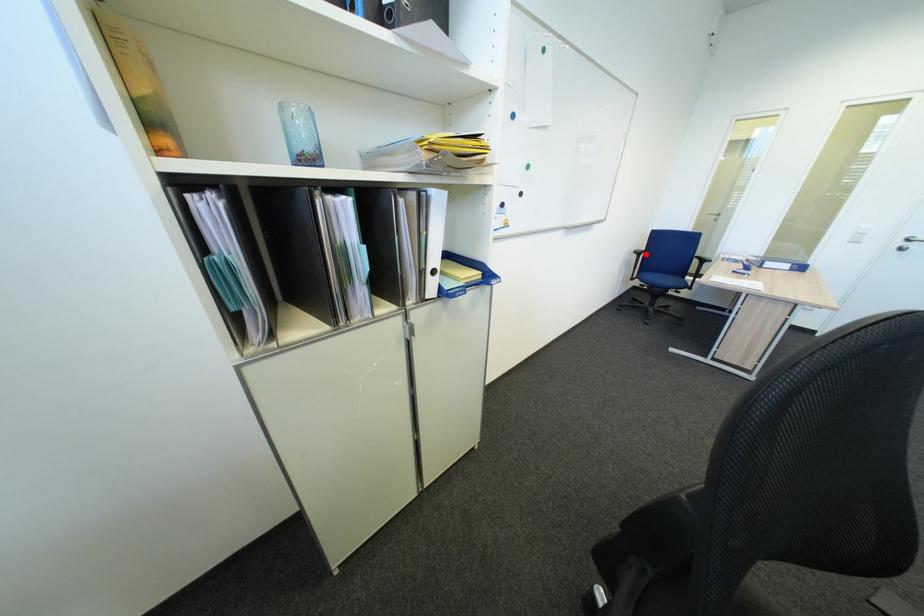
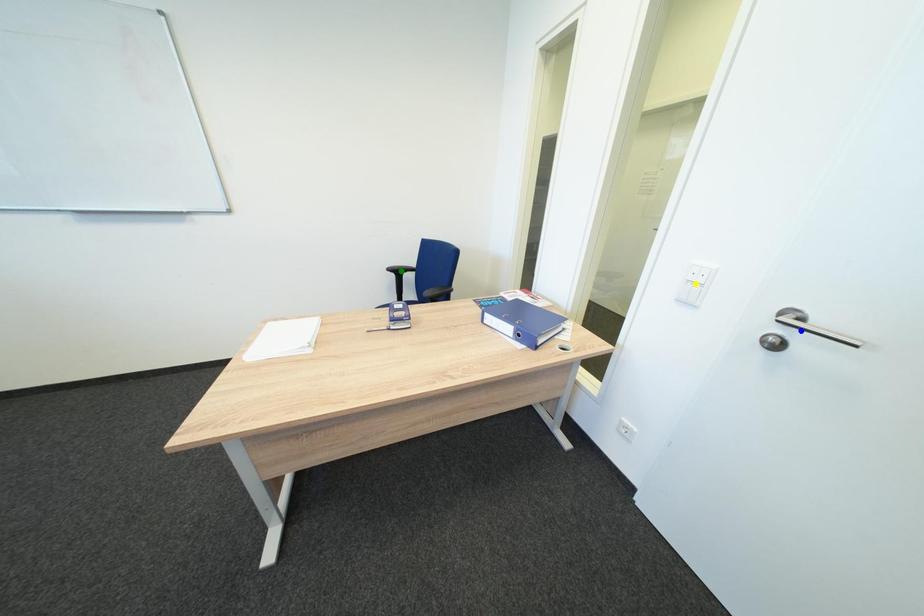
Question: I am providing you with two images of the same scene from different viewpoints. A red point is marked on the first image. You are given multiple points on the second image. Which point in image 2 represents the same 3d spot as the red point in image 1?

Choices:
 (A) blue point
 (B) green point
 (C) yellow point

Answer: (B)